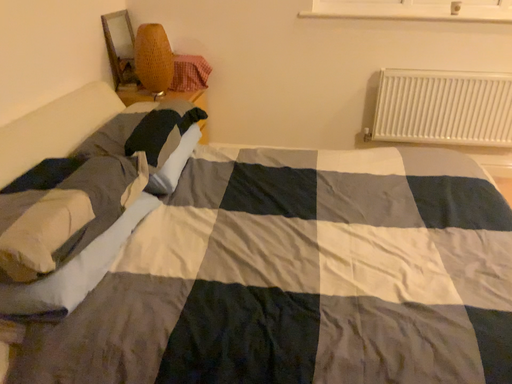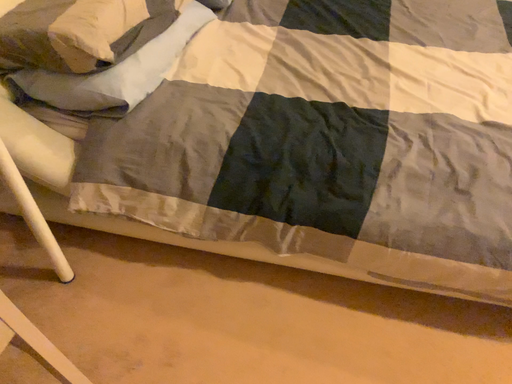
Question: Which way did the camera rotate in the video?

Choices:
 (A) rotated upward
 (B) rotated downward

Answer: (B)